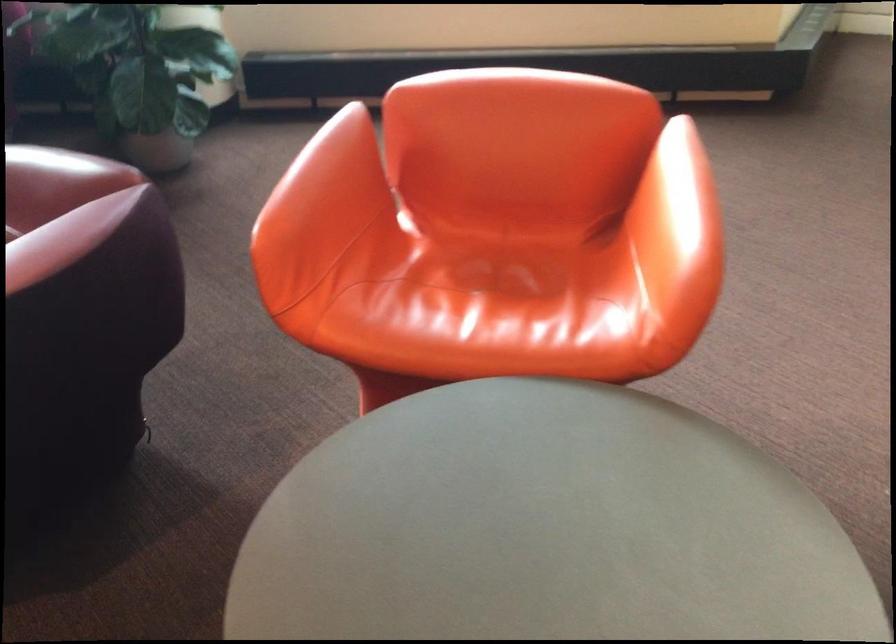
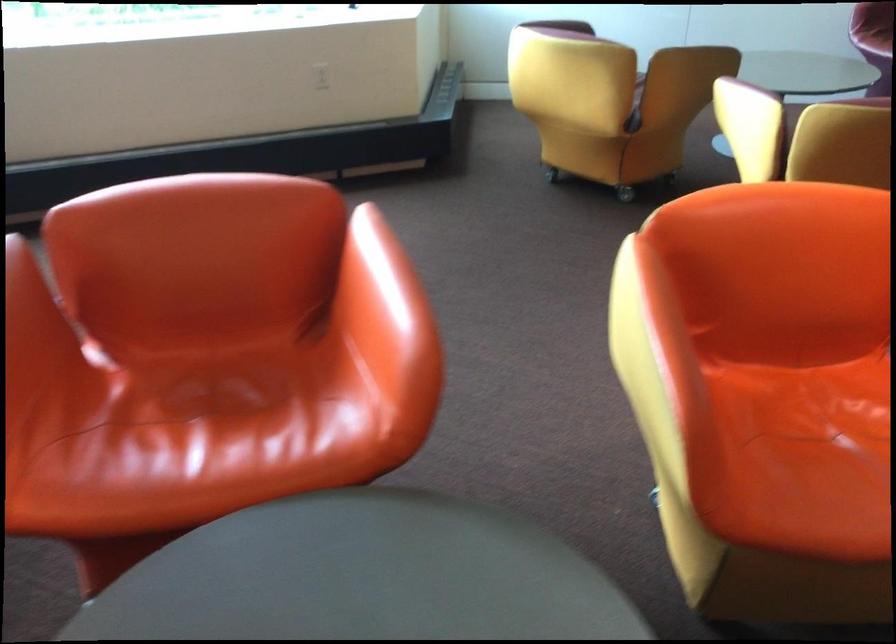
Locate, in the second image, the point that corresponds to point (695, 194) in the first image.

(397, 283)